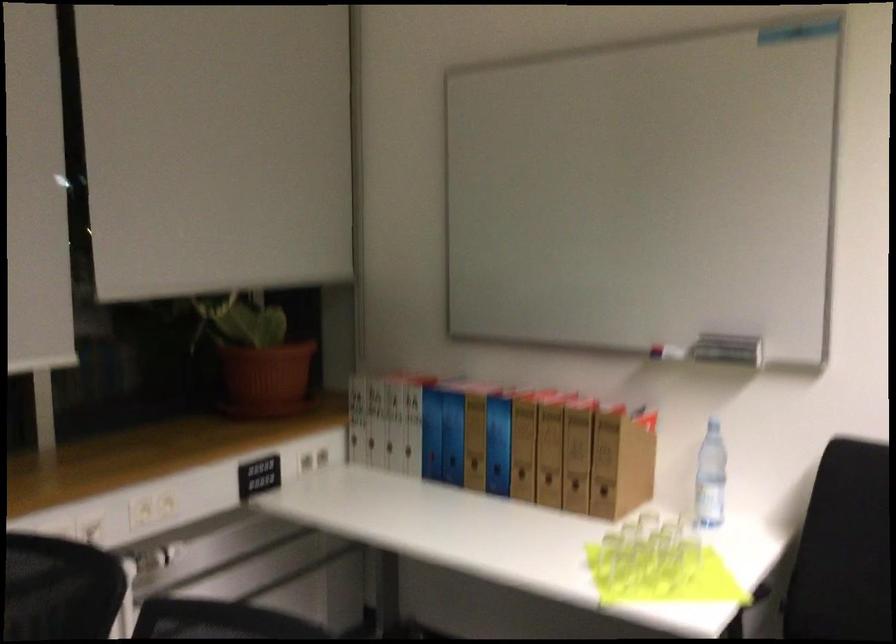
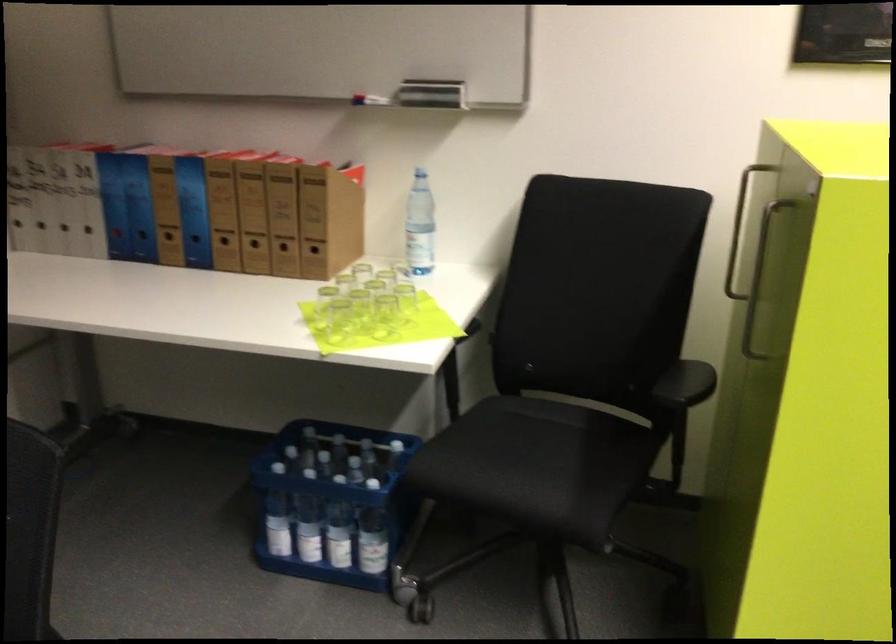
Locate, in the second image, the point that corresponds to (576,491) in the first image.

(283, 252)